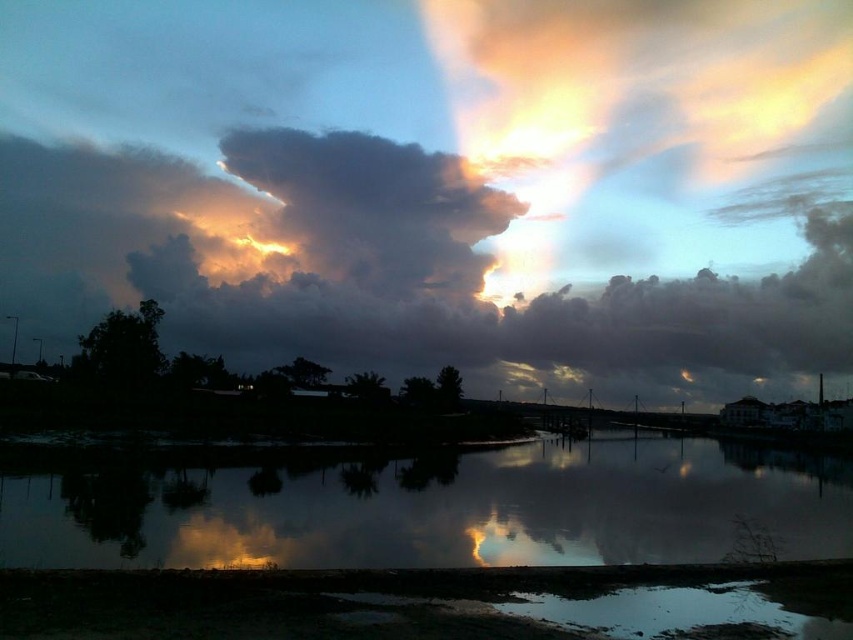
Between smooth reflective water at center and dark gray fluffy cloud at upper center, which one has less height?

smooth reflective water at center

Does smooth reflective water at center appear on the right side of dark gray fluffy cloud at upper center?

Correct, you'll find smooth reflective water at center to the right of dark gray fluffy cloud at upper center.

Which is behind, point (357, 483) or point (479, 227)?

Point (479, 227)

Where is `smooth reflective water at center`? The width and height of the screenshot is (853, 640). smooth reflective water at center is located at coordinates (431, 508).